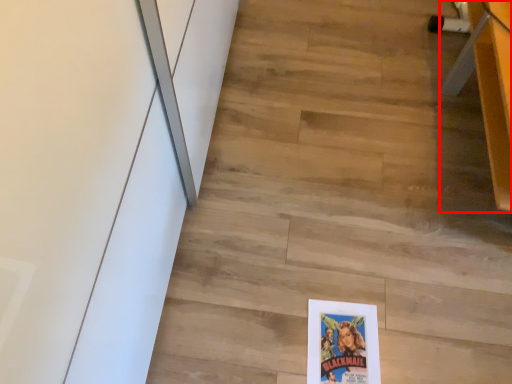
Question: From the image's perspective, considering the relative positions of furniture (annotated by the red box) and stair in the image provided, where is furniture (annotated by the red box) located with respect to the staircase?

Choices:
 (A) above
 (B) below

Answer: (A)